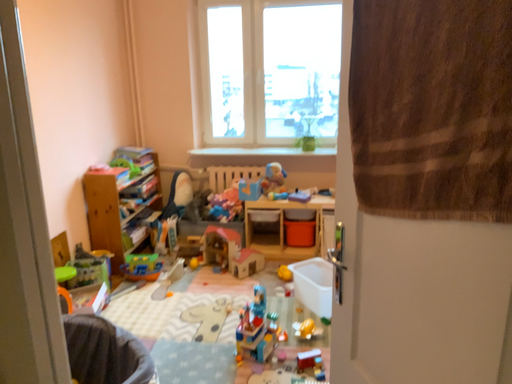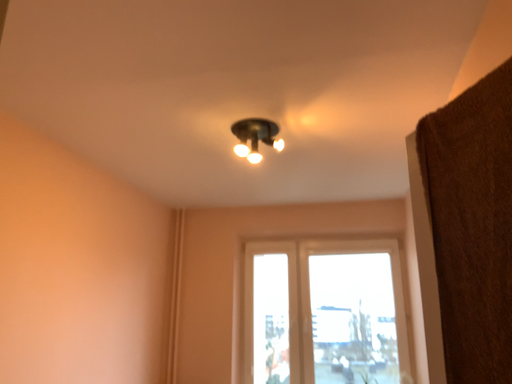
Question: How did the camera likely rotate when shooting the video?

Choices:
 (A) rotated upward
 (B) rotated downward

Answer: (A)